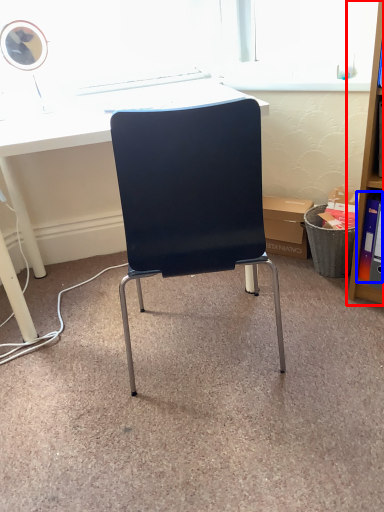
Question: Among these objects, which one is farthest to the camera, shelf (highlighted by a red box) or book (highlighted by a blue box)?

Choices:
 (A) shelf
 (B) book

Answer: (B)